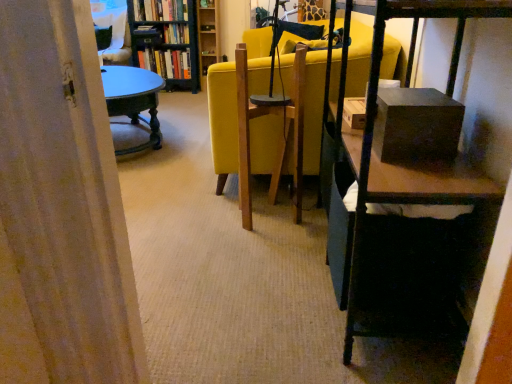
Locate an element on the screen. Image resolution: width=512 pixels, height=384 pixels. hardcover book at center, placed as the 2th book when sorted from bottom to top is located at coordinates (176, 34).

Describe the element at coordinates (160, 10) in the screenshot. The image size is (512, 384). I see `hardcover books at upper left, placed as the 1th book when sorted from top to bottom` at that location.

This screenshot has width=512, height=384. Describe the element at coordinates (208, 35) in the screenshot. I see `wooden bookshelf at upper center` at that location.

The height and width of the screenshot is (384, 512). Describe the element at coordinates (133, 100) in the screenshot. I see `green painted wood table at center left` at that location.

Where is `hardcover book at center, the 2th book in the top-to-bottom sequence`? The image size is (512, 384). hardcover book at center, the 2th book in the top-to-bottom sequence is located at coordinates (176, 34).

Can you confirm if hardcover book at center, placed as the 2th book when sorted from bottom to top, is thinner than hardcover books at upper left, placed as the 1th book when sorted from top to bottom?

Yes.

Is the depth of hardcover book at center, the 2th book in the top-to-bottom sequence, greater than that of hardcover books at upper left, placed as the 1th book when sorted from top to bottom?

That is True.

Is hardcover book at center, placed as the 2th book when sorted from bottom to top, looking in the opposite direction of hardcover books at upper left, placed as the 1th book when sorted from top to bottom?

No, hardcover book at center, placed as the 2th book when sorted from bottom to top,'s orientation is not away from hardcover books at upper left, placed as the 1th book when sorted from top to bottom.

Locate an element on the screen. the 1st book behind the hardcover books at upper left, which is the 3th book from bottom to top is located at coordinates (176, 34).

Is green painted wood table at center left to the left or to the right of wooden bookshelf at upper left in the image?

From the image, it's evident that green painted wood table at center left is to the left of wooden bookshelf at upper left.

Is green painted wood table at center left wider than wooden bookshelf at upper left?

Correct, the width of green painted wood table at center left exceeds that of wooden bookshelf at upper left.

Is green painted wood table at center left beside wooden bookshelf at upper left?

green painted wood table at center left and wooden bookshelf at upper left are not in contact.

From a real-world perspective, between green painted wood table at center left and wooden bookshelf at upper left, who is vertically lower?

In real-world perspective, green painted wood table at center left is lower.

Where is `table in front of the wooden bookshelf at upper left`? This screenshot has width=512, height=384. table in front of the wooden bookshelf at upper left is located at coordinates [x=133, y=100].

Are wooden bookshelf at upper left and green painted wood table at center left far apart?

wooden bookshelf at upper left is positioned a significant distance from green painted wood table at center left.

How many degrees apart are the facing directions of wooden bookshelf at upper left and green painted wood table at center left?

They differ by 57.9 degrees in their facing directions.

From the image's perspective, which is above, wooden bookshelf at upper left or green painted wood table at center left?

wooden bookshelf at upper left appears higher in the image.

Is hardcover book at center, placed as the 2th book when sorted from bottom to top, located within wooden bookshelf at upper center?

No, hardcover book at center, placed as the 2th book when sorted from bottom to top, is not surrounded by wooden bookshelf at upper center.

Can you confirm if wooden bookshelf at upper center is positioned to the left of hardcover book at center, placed as the 2th book when sorted from bottom to top?

No, wooden bookshelf at upper center is not to the left of hardcover book at center, placed as the 2th book when sorted from bottom to top.

From the image's perspective, is wooden bookshelf at upper center located beneath hardcover book at center, placed as the 2th book when sorted from bottom to top?

Incorrect, from the image's perspective, wooden bookshelf at upper center is higher than hardcover book at center, placed as the 2th book when sorted from bottom to top.

Locate an element on the screen. This screenshot has height=384, width=512. shelf above the hardcover book at center, placed as the 2th book when sorted from bottom to top (from the image's perspective) is located at coordinates (208, 35).

Can you confirm if hardcover book at center, placed as the 2th book when sorted from bottom to top, is smaller than wooden bookshelf at upper center?

Yes, hardcover book at center, placed as the 2th book when sorted from bottom to top, is smaller than wooden bookshelf at upper center.

From the image's perspective, who appears lower, hardcover book at center, placed as the 2th book when sorted from bottom to top, or wooden bookshelf at upper center?

hardcover book at center, placed as the 2th book when sorted from bottom to top.

What's the angular difference between hardcover book at center, placed as the 2th book when sorted from bottom to top, and wooden bookshelf at upper center's facing directions?

The angular difference between hardcover book at center, placed as the 2th book when sorted from bottom to top, and wooden bookshelf at upper center is 0.326 degrees.

Is point (135, 19) more distant than point (180, 27)?

No, it is not.

Which of these two, hardcover books at upper left, which is the 3th book from bottom to top, or wooden bookshelf at upper left, stands taller?

With more height is wooden bookshelf at upper left.

Are hardcover books at upper left, which is the 3th book from bottom to top, and wooden bookshelf at upper left far apart?

hardcover books at upper left, which is the 3th book from bottom to top, is near wooden bookshelf at upper left, not far away.

Considering the relative positions of hardcover books at upper left, placed as the 1th book when sorted from top to bottom, and wooden bookshelf at upper left in the image provided, is hardcover books at upper left, placed as the 1th book when sorted from top to bottom, behind wooden bookshelf at upper left?

Yes.

From a real-world perspective, which book is the 1st one above the wooden bookshelf at upper left? Please provide its 2D coordinates.

[(176, 34)]

Is point (144, 21) closer to viewer compared to point (182, 38)?

Yes, point (144, 21) is in front of point (182, 38).

Who is bigger, wooden bookshelf at upper left or hardcover book at center, placed as the 2th book when sorted from bottom to top?

Bigger between the two is wooden bookshelf at upper left.

How many degrees apart are the facing directions of wooden bookshelf at upper left and hardcover book at center, the 2th book in the top-to-bottom sequence?

They differ by 0.361 degrees in their facing directions.

Locate an element on the screen. book that is above the hardcover book at center, the 2th book in the top-to-bottom sequence (from a real-world perspective) is located at coordinates (160, 10).

Find the location of `table in front of the wooden bookshelf at upper left`. table in front of the wooden bookshelf at upper left is located at coordinates (133, 100).

From the image, which object appears to be nearer to wooden bookshelf at upper left, hardcover books at upper left, placed as the 1th book when sorted from top to bottom, or hardcover book at upper left, positioned as the 3th book in top-to-bottom order?

The object closer to wooden bookshelf at upper left is hardcover book at upper left, positioned as the 3th book in top-to-bottom order.

Considering their positions, is hardcover book at center, the 2th book in the top-to-bottom sequence, positioned further to hardcover books at upper left, which is the 3th book from bottom to top, than wooden bookshelf at upper left?

Among the two, wooden bookshelf at upper left is located further to hardcover books at upper left, which is the 3th book from bottom to top.

Looking at the image, which one is located closer to hardcover books at upper left, placed as the 1th book when sorted from top to bottom, hardcover book at center, placed as the 2th book when sorted from bottom to top, or hardcover book at upper left, positioned as the 3th book in top-to-bottom order?

Among the two, hardcover book at center, placed as the 2th book when sorted from bottom to top, is located nearer to hardcover books at upper left, placed as the 1th book when sorted from top to bottom.

Looking at the image, which one is located further to hardcover books at upper left, which is the 3th book from bottom to top, hardcover book at center, the 2th book in the top-to-bottom sequence, or green painted wood table at center left?

green painted wood table at center left is further to hardcover books at upper left, which is the 3th book from bottom to top.

Based on their spatial positions, is wooden bookshelf at upper left or hardcover book at center, placed as the 2th book when sorted from bottom to top, further from hardcover book at upper left, the first book ordered from the bottom?

hardcover book at center, placed as the 2th book when sorted from bottom to top.

Which object lies further to the anchor point hardcover book at center, placed as the 2th book when sorted from bottom to top, wooden bookshelf at upper center or hardcover books at upper left, placed as the 1th book when sorted from top to bottom?

wooden bookshelf at upper center lies further to hardcover book at center, placed as the 2th book when sorted from bottom to top, than the other object.

From the image, which object appears to be nearer to wooden bookshelf at upper left, wooden bookshelf at upper center or hardcover book at center, the 2th book in the top-to-bottom sequence?

hardcover book at center, the 2th book in the top-to-bottom sequence, is positioned closer to the anchor wooden bookshelf at upper left.

Estimate the real-world distances between objects in this image. Which object is further from wooden bookshelf at upper left, hardcover books at upper left, which is the 3th book from bottom to top, or green painted wood table at center left?

green painted wood table at center left is further to wooden bookshelf at upper left.

I want to click on book between hardcover books at upper left, which is the 3th book from bottom to top, and wooden bookshelf at upper left vertically, so click(x=176, y=34).

Where is `book between green painted wood table at center left and wooden bookshelf at upper center in the front-back direction`? Image resolution: width=512 pixels, height=384 pixels. book between green painted wood table at center left and wooden bookshelf at upper center in the front-back direction is located at coordinates (160, 10).

Identify the location of bookcase between hardcover book at upper left, positioned as the 3th book in top-to-bottom order, and wooden bookshelf at upper center from left to right. The height and width of the screenshot is (384, 512). (166, 40).

You are a GUI agent. You are given a task and a screenshot of the screen. Output one action in this format:
    pyautogui.click(x=<x>, y=<y>)
    Task: Click on the shelf between green painted wood table at center left and hardcover book at upper left, the first book ordered from the bottom, along the z-axis
    
    Given the screenshot: What is the action you would take?
    pyautogui.click(x=208, y=35)